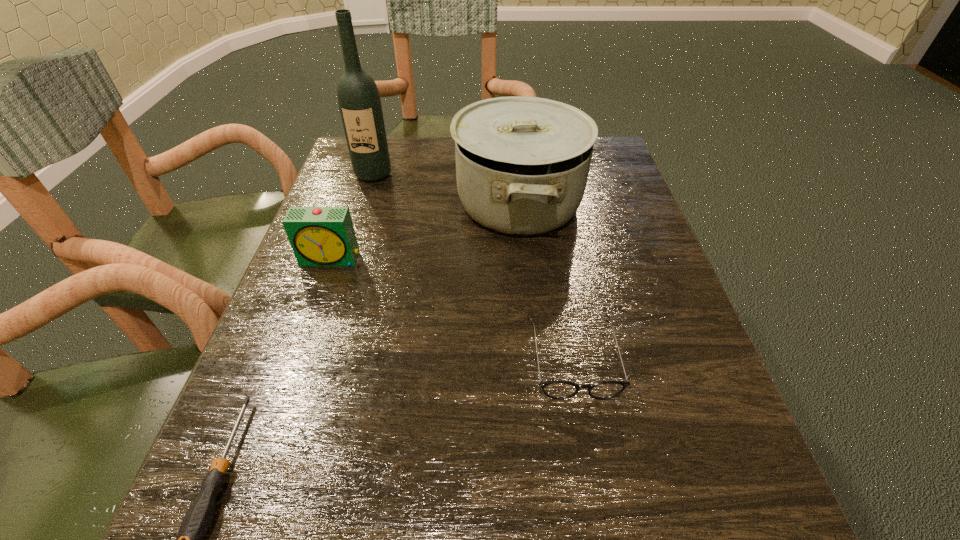
Locate which object ranks fourth in proximity to the shortest object. Please provide its 2D coordinates. Your answer should be formatted as a tuple, i.e. [(x, y)], where the tuple contains the x and y coordinates of a point satisfying the conditions above.

[(359, 101)]

Point out which object is positioned as the nearest to the tallest object. Please provide its 2D coordinates. Your answer should be formatted as a tuple, i.e. [(x, y)], where the tuple contains the x and y coordinates of a point satisfying the conditions above.

[(522, 163)]

Locate an element on the screen. Image resolution: width=960 pixels, height=540 pixels. blank space that satisfies the following two spatial constraints: 1. on the labeled side of the saucepan; 2. on the left side of the tallest object is located at coordinates (364, 204).